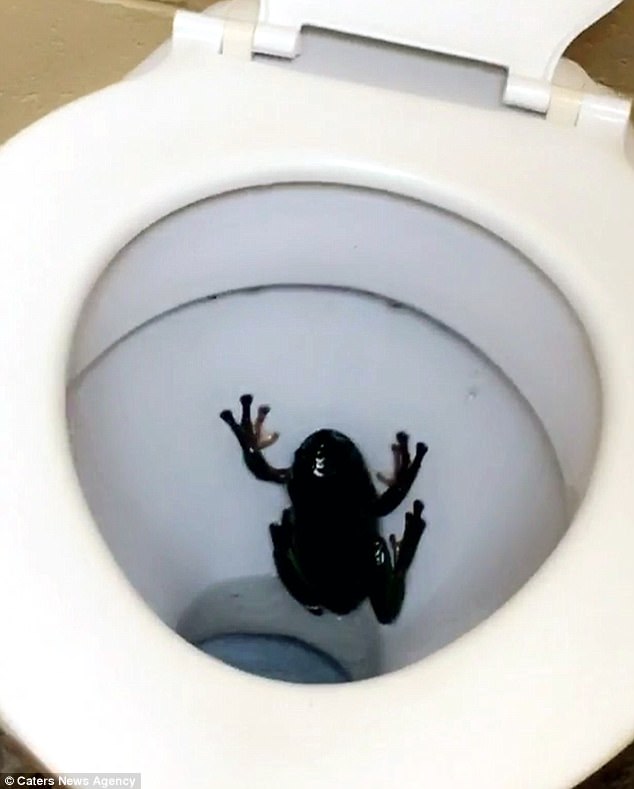
Where is `toilet seat hinge`? This screenshot has width=634, height=789. toilet seat hinge is located at coordinates (562, 101), (236, 34).